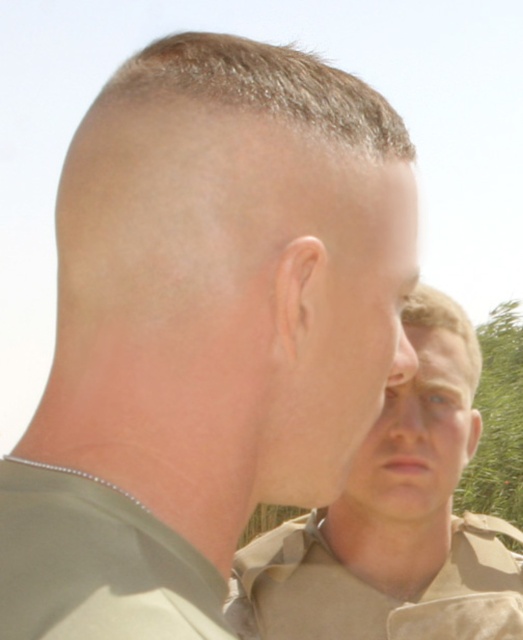
Based on the scene description, where is the tan uniform at center located in terms of coordinates?

The tan uniform at center is located at coordinates point (394,520).